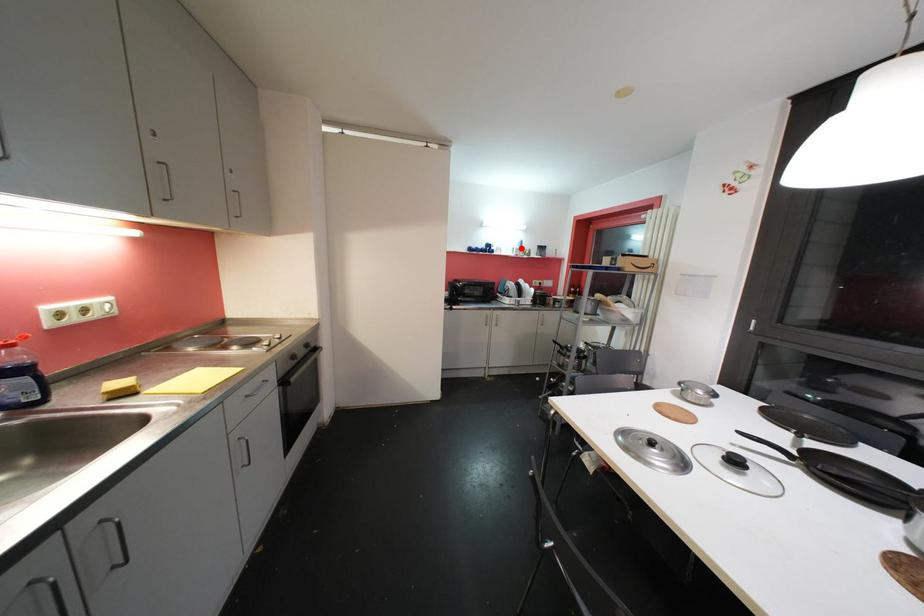
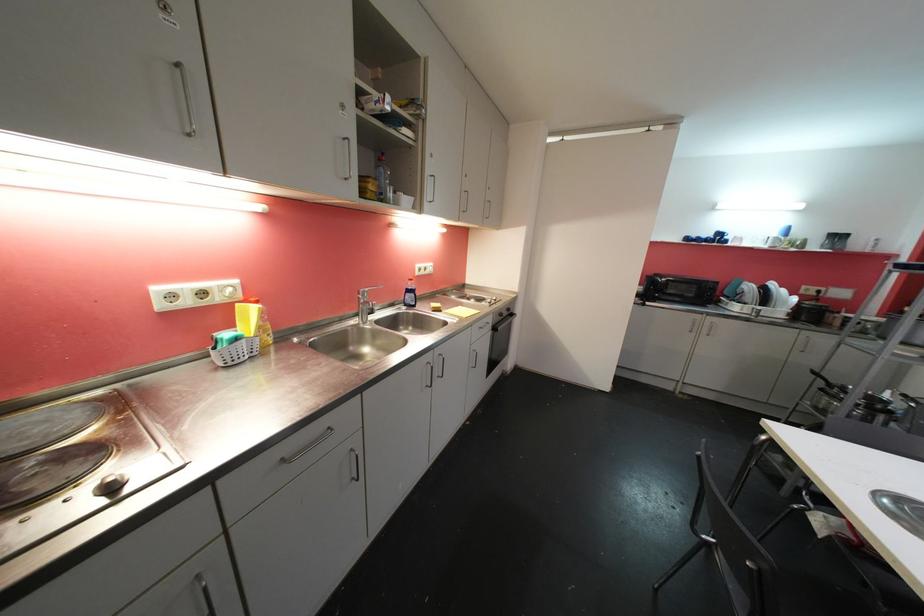
Where in the second image is the point corresponding to the highlighted location from the first image?

(781, 236)